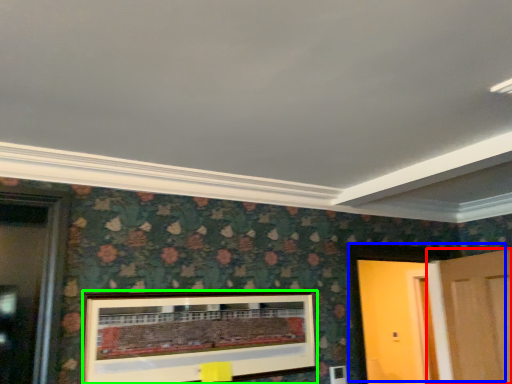
Question: Considering the real-world distances, which object is closest to door (highlighted by a red box)? door (highlighted by a blue box) or picture frame (highlighted by a green box).

Choices:
 (A) door
 (B) picture frame

Answer: (A)